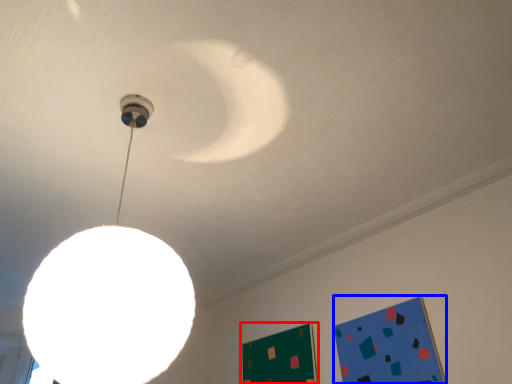
Question: Which object appears farthest to the camera in this image, bulletin board (highlighted by a red box) or bulletin board (highlighted by a blue box)?

Choices:
 (A) bulletin board
 (B) bulletin board

Answer: (A)